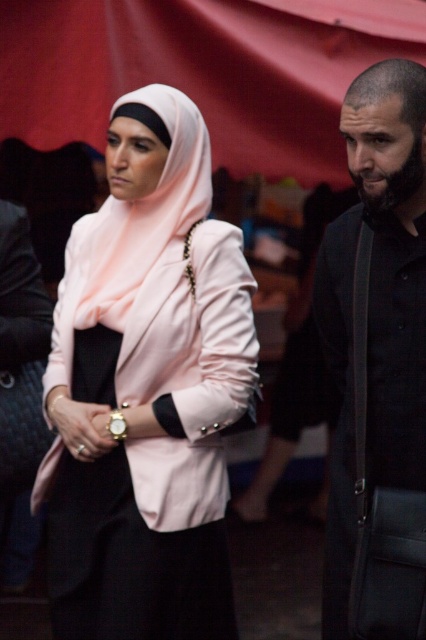
Question: Can you confirm if matte pink blazer at center is positioned to the left of black matte shirt at right?

Choices:
 (A) no
 (B) yes

Answer: (B)

Question: Is matte pink blazer at center above black matte shirt at right?

Choices:
 (A) yes
 (B) no

Answer: (B)

Question: Which object is closer to the camera taking this photo?

Choices:
 (A) matte pink blazer at center
 (B) black matte shirt at right

Answer: (B)

Question: Which point appears farthest from the camera in this image?

Choices:
 (A) (423, 390)
 (B) (184, 344)

Answer: (B)

Question: Does matte pink blazer at center have a greater width compared to black matte shirt at right?

Choices:
 (A) yes
 (B) no

Answer: (A)